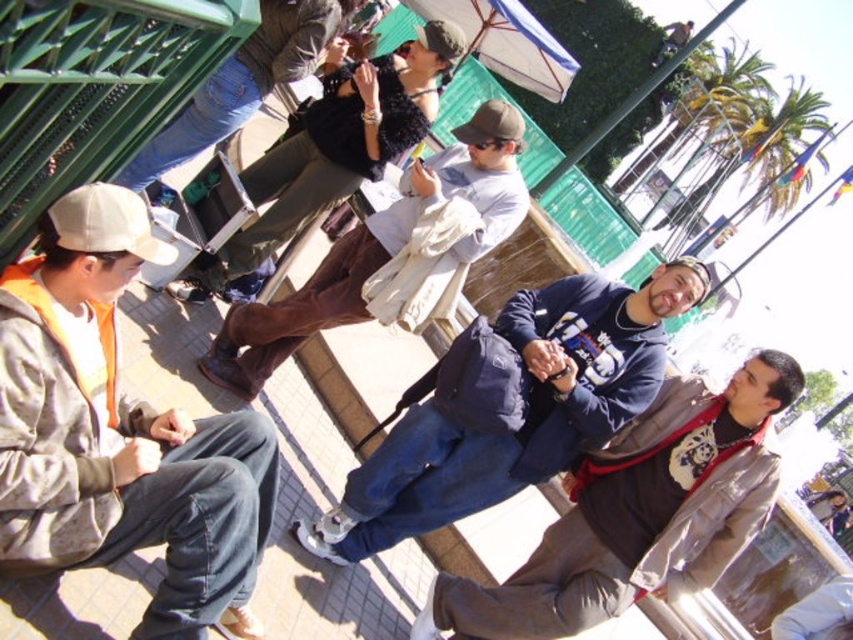
Question: Estimate the real-world distances between objects in this image. Which object is farther from the dark blue jacket at center?

Choices:
 (A) dark blue sweatshirt at center
 (B) white fabric umbrella at upper center
 (C) dark brown leather jacket at upper center
 (D) white matte baseball hat at left

Answer: (B)

Question: Which point is closer to the camera?

Choices:
 (A) dark brown leather jacket at upper center
 (B) white matte baseball hat at left
 (C) dark blue jacket at center

Answer: (B)

Question: Does dark brown leather pants at center appear under white fabric umbrella at upper center?

Choices:
 (A) no
 (B) yes

Answer: (B)

Question: Does jeans at upper left appear under matte brown baseball cap at center?

Choices:
 (A) no
 (B) yes

Answer: (A)

Question: Can you confirm if dark blue jacket at center is positioned to the left of dark brown leather jacket at upper center?

Choices:
 (A) no
 (B) yes

Answer: (A)

Question: Which object is positioned farthest from the dark brown leather pants at center?

Choices:
 (A) white fabric umbrella at upper center
 (B) matte brown baseball cap at center

Answer: (A)